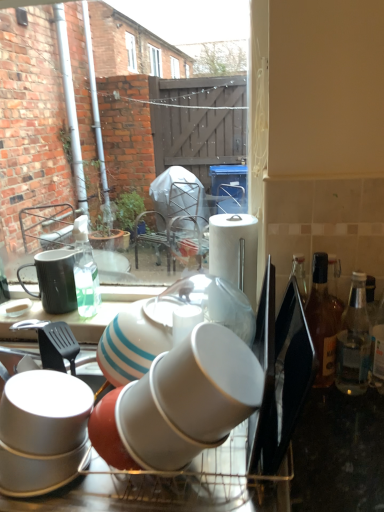
Question: From a real-world perspective, is white glossy cup at center, marked as the 1th tableware in a right-to-left arrangement, above or below white glossy cups at center?

Choices:
 (A) above
 (B) below

Answer: (A)

Question: Looking at the image, does white glossy cup at center, the 1th tableware viewed from the front, seem bigger or smaller compared to white glossy cups at center?

Choices:
 (A) big
 (B) small

Answer: (B)

Question: Based on their relative distances, which object is farther from the translucent glass bottle at right, positioned as the 2th bottle in right-to-left order?

Choices:
 (A) clear glass bottle at right, which is the second bottle in left-to-right order
 (B) white glossy cup at center, placed as the 2th tableware when sorted from left to right
 (C) white glossy cups at center
 (D) white glossy cup at lower left
 (E) white matte paper towel at upper right

Answer: (D)

Question: Based on their relative distances, which object is nearer to the matte black mug at left, which is the first tableware in left-to-right order?

Choices:
 (A) translucent glass bottle at right, positioned as the 2th bottle in right-to-left order
 (B) clear glass bottle at right, which is the second bottle in left-to-right order
 (C) white glossy cup at center, the 1th tableware viewed from the front
 (D) white matte paper towel at upper right
 (E) white glossy cups at center

Answer: (C)